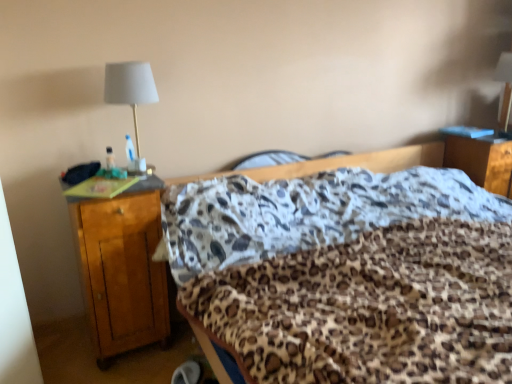
Question: Is point pyautogui.click(x=211, y=354) closer or farther from the camera than point pyautogui.click(x=140, y=240)?

Choices:
 (A) closer
 (B) farther

Answer: (A)

Question: Looking at the image, does leopard print fabric at center seem bigger or smaller compared to wooden nightstand at left, marked as the 1th nightstand in a left-to-right arrangement?

Choices:
 (A) big
 (B) small

Answer: (A)

Question: Which of these objects is positioned farthest from the matte white lampshade at upper left?

Choices:
 (A) leopard print fabric at center
 (B) wooden nightstand at left, acting as the 2th nightstand starting from the back
 (C) wooden nightstand at lower right, which is counted as the 2th nightstand, starting from the front

Answer: (C)

Question: Estimate the real-world distances between objects in this image. Which object is farther from the matte white lampshade at upper left?

Choices:
 (A) wooden nightstand at left, the 1th nightstand in the front-to-back sequence
 (B) wooden nightstand at lower right, the 1th nightstand when ordered from right to left
 (C) leopard print fabric at center

Answer: (B)